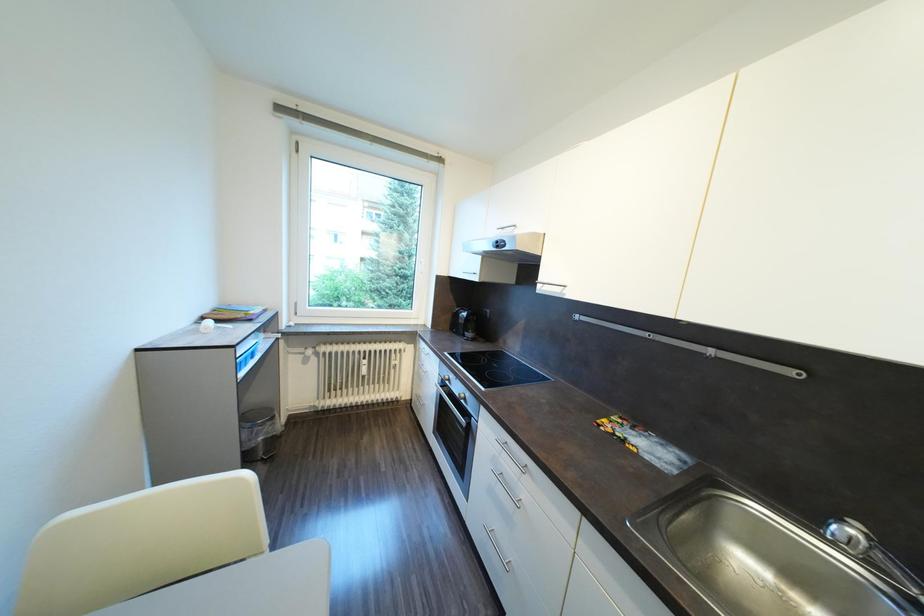
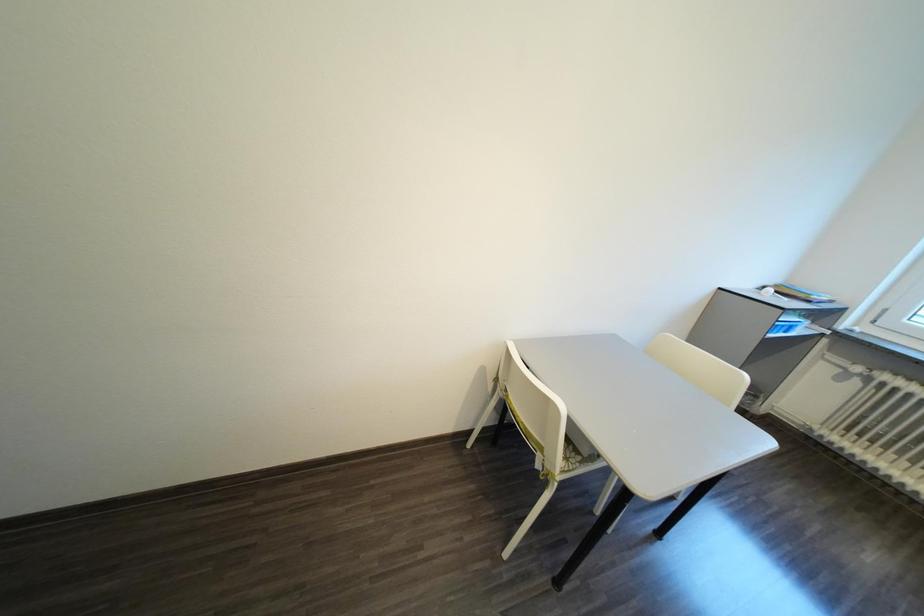
From the picture: First-person continuous shooting, in which direction is the camera rotating?

The camera rotated toward left-down.